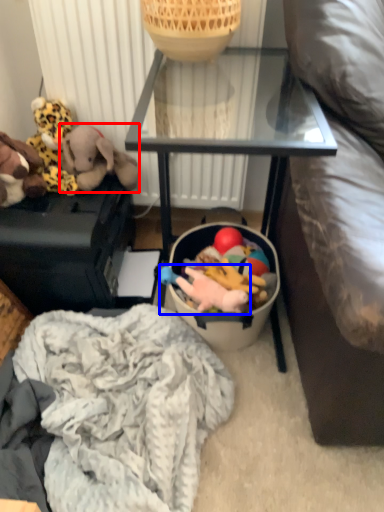
Question: Which object is further to the camera taking this photo, toy (highlighted by a red box) or toy (highlighted by a blue box)?

Choices:
 (A) toy
 (B) toy

Answer: (A)